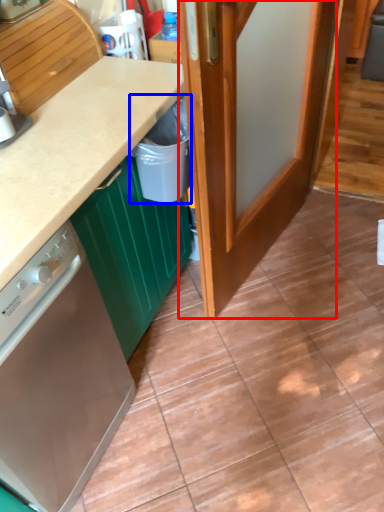
Question: Which point is further to the camera, door (highlighted by a red box) or recycling bin (highlighted by a blue box)?

Choices:
 (A) door
 (B) recycling bin

Answer: (B)